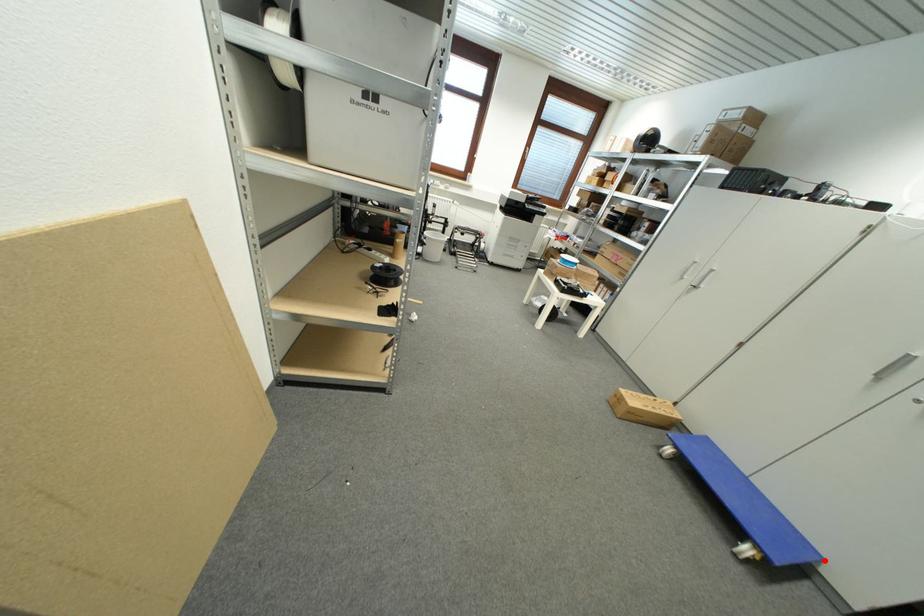
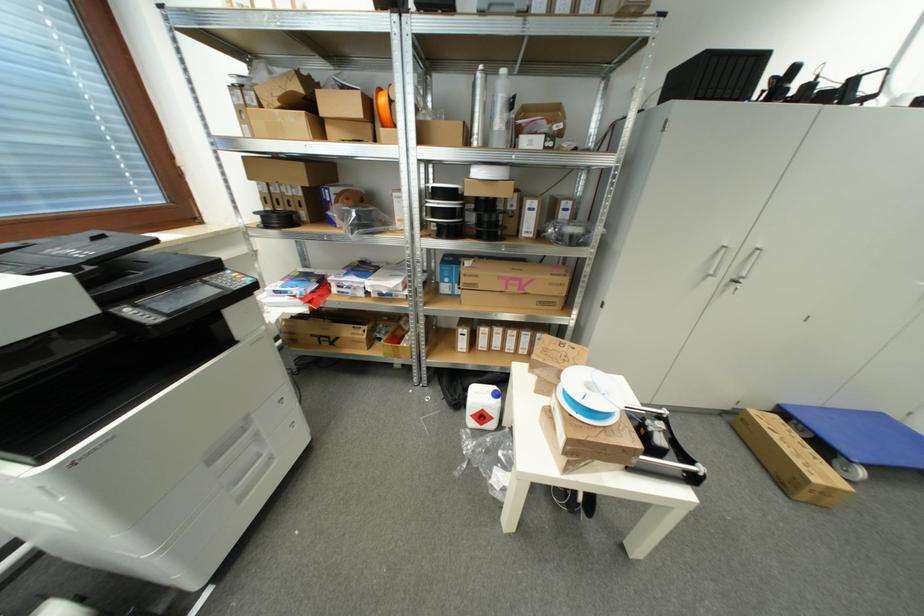
Find the pixel in the second image that matches the highlighted location in the first image.

(885, 418)